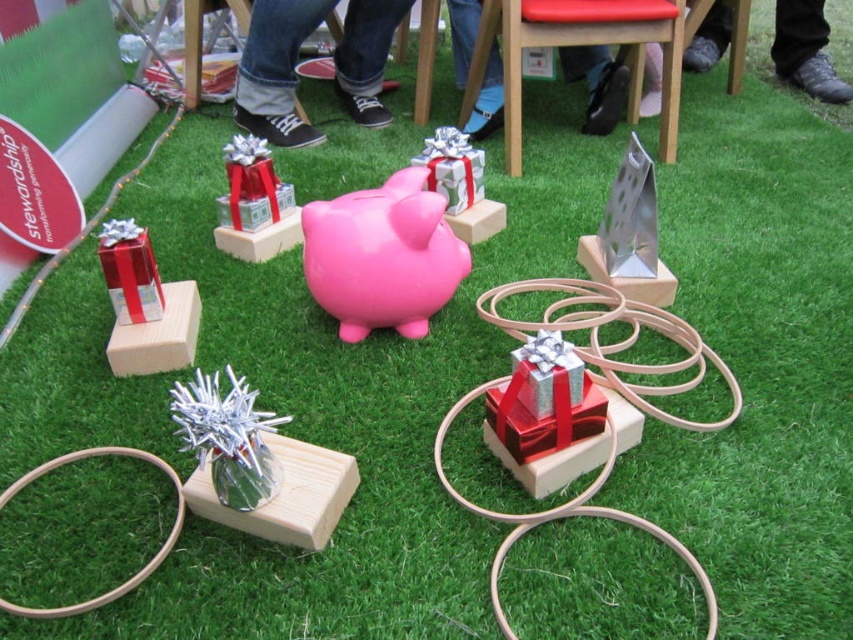
Question: Which is nearer to the shiny red gift at center?

Choices:
 (A) silver shiny gift at center
 (B) metallic silver chair at upper right
 (C) silver metallic tinsel at center
 (D) pink matte piggy bank at center

Answer: (D)

Question: Among these points, which one is farthest from the camera?

Choices:
 (A) (370, 272)
 (B) (131, 227)

Answer: (B)

Question: Which object is the farthest from the metallic silver triangular stand at center?

Choices:
 (A) shiny red gift at left
 (B) silver metallic tinsel at center
 (C) shiny silver gift at center
 (D) shiny red gift at center

Answer: (A)

Question: Is the position of silver shiny gift at center less distant than that of shiny red gift at left?

Choices:
 (A) no
 (B) yes

Answer: (A)

Question: Can you confirm if metallic silver chair at upper right is wider than shiny red gift at left?

Choices:
 (A) yes
 (B) no

Answer: (A)

Question: Does pink matte piggy bank at center appear over metallic silver triangular stand at center?

Choices:
 (A) yes
 (B) no

Answer: (B)